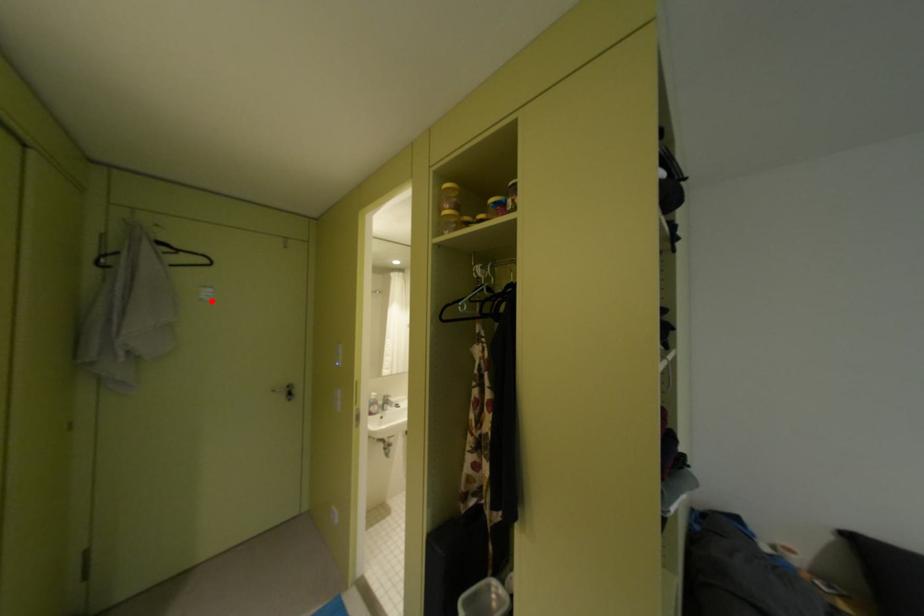
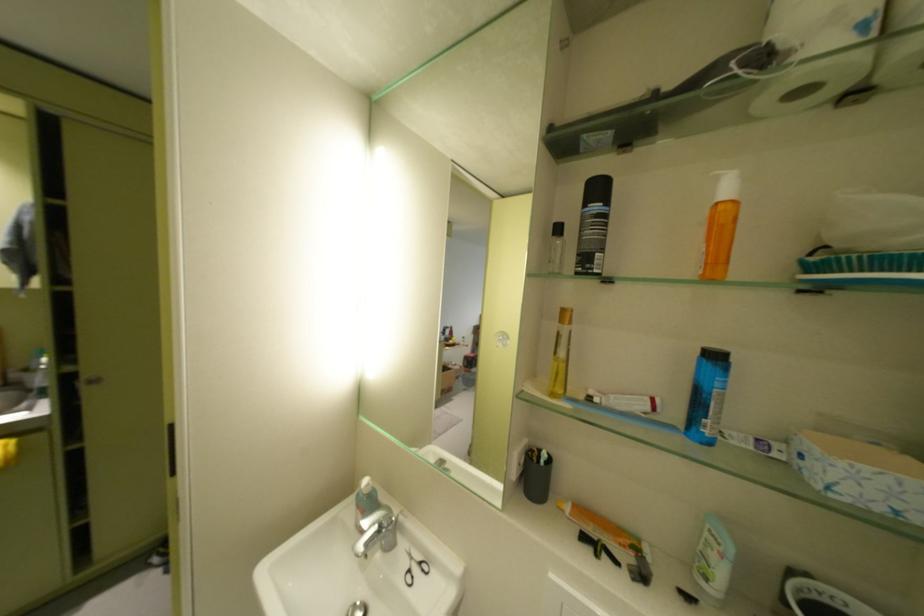
Question: I am providing you with two images of the same scene from different viewpoints. A red point is marked on the first image. At the location where the point appears in image 1, is it still visible in image 2?

Choices:
 (A) Yes
 (B) No

Answer: (B)